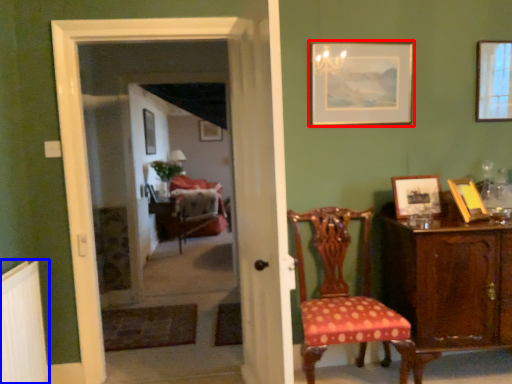
Question: Which point is closer to the camera, picture frame (highlighted by a red box) or radiator (highlighted by a blue box)?

Choices:
 (A) picture frame
 (B) radiator

Answer: (B)